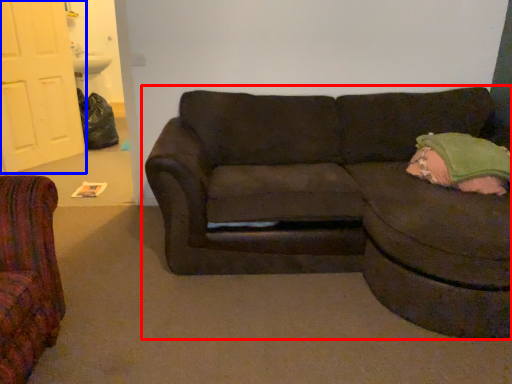
Question: Among these objects, which one is farthest to the camera, studio couch (highlighted by a red box) or door (highlighted by a blue box)?

Choices:
 (A) studio couch
 (B) door

Answer: (B)